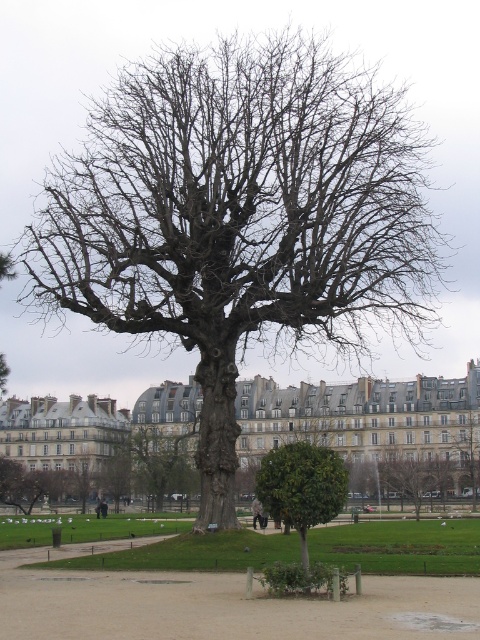
Consider the image. Does green grass at center appear on the right side of green leafy tree at center?

No, green grass at center is not to the right of green leafy tree at center.

Where is `green grass at center`? The width and height of the screenshot is (480, 640). green grass at center is located at coordinates (217, 602).

From the picture: Is green grass at center above bare wood tree at center?

No.

Is green grass at center to the right of bare wood tree at center from the viewer's perspective?

In fact, green grass at center is to the left of bare wood tree at center.

Does point (422, 608) come in front of point (479, 449)?

Yes, it is.

The width and height of the screenshot is (480, 640). In order to click on green grass at center in this screenshot , I will do `click(217, 602)`.

Between green leafy tree at center and bare wood tree at center, which one appears on the left side from the viewer's perspective?

Positioned to the left is green leafy tree at center.

In the scene shown: Measure the distance between green leafy tree at center and camera.

green leafy tree at center and camera are 68.73 meters apart from each other.

Find the location of a particular element. This screenshot has height=640, width=480. green leafy tree at center is located at coordinates (301, 486).